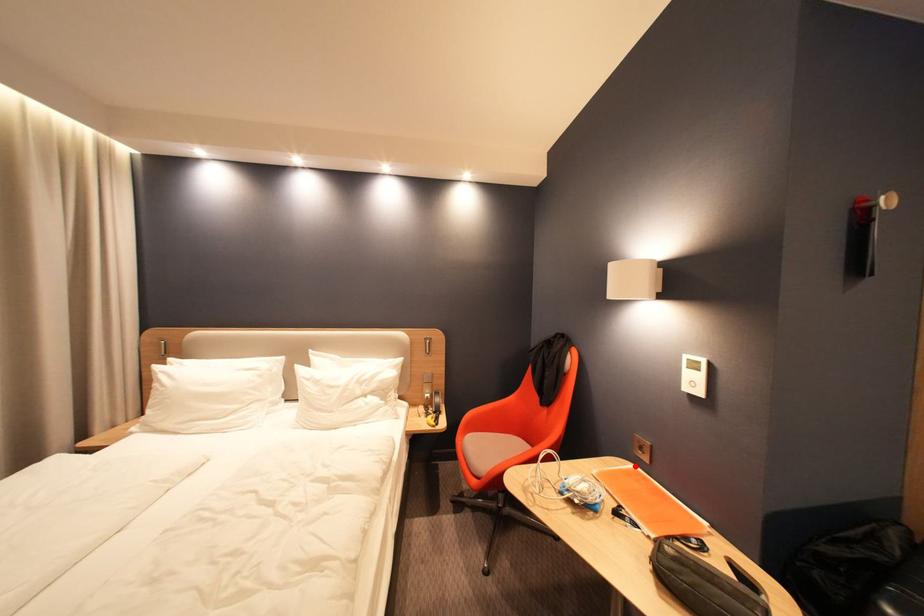
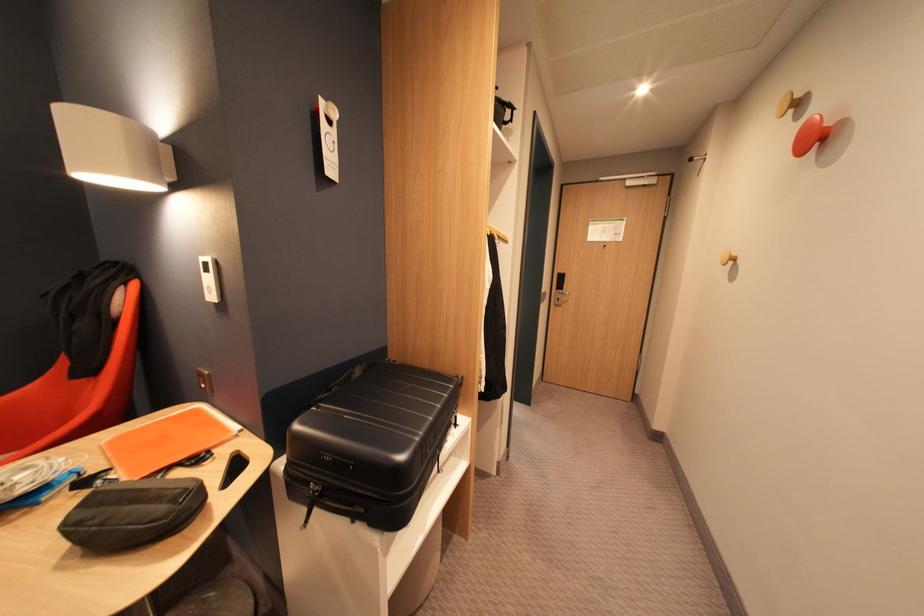
Where in the second image is the point corresponding to the highlighted location from the first image?

(195, 410)